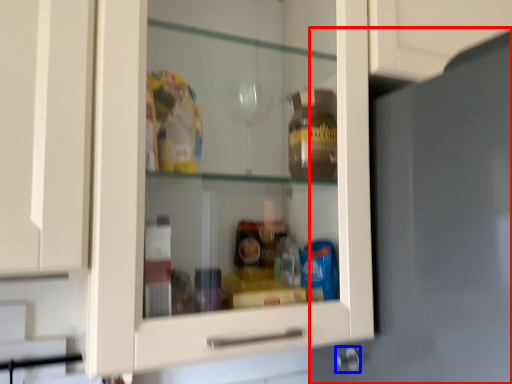
Question: Which point is further to the camera, door (highlighted by a red box) or knob (highlighted by a blue box)?

Choices:
 (A) door
 (B) knob

Answer: (B)